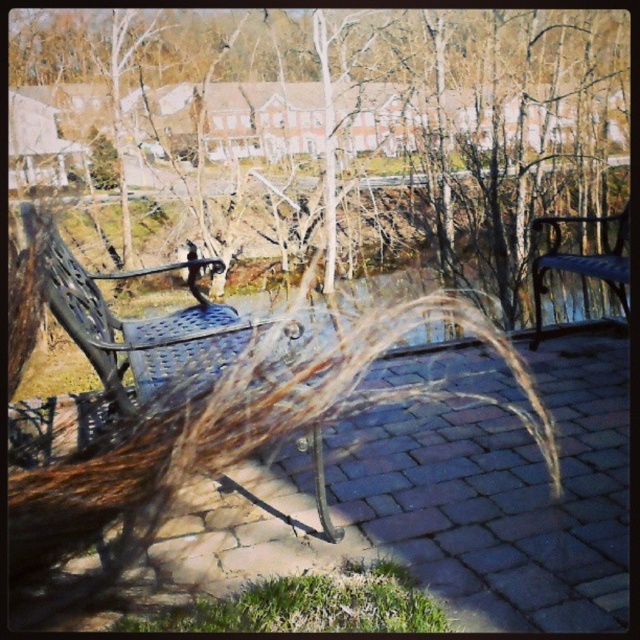
You are standing at the edge of the balcony and want to place a small potted plant exactly at the center of the brown textured grass at center. According to the coordinates provided, where should you place the potted plant?

The brown textured grass at center is located at coordinates point (337, 129), so you should place the potted plant at those coordinates to center it.

You are standing on the balcony and want to place a small potted plant between the two points, point (109, 68) and point (604, 228). Which point should the plant be closer to in order to be closer to the viewer?

The plant should be closer to point (109, 68) because it is closer to the viewer than point (604, 228).

You are a delivery person trying to place a package between the metallic blue bench at center and the metallic blue bench at right. The package is 4 feet long. Can you fit the package between them?

The metallic blue bench at center and metallic blue bench at right are 4.31 feet apart from each other, so yes, the package can fit between them since it is shorter than the distance between the benches.